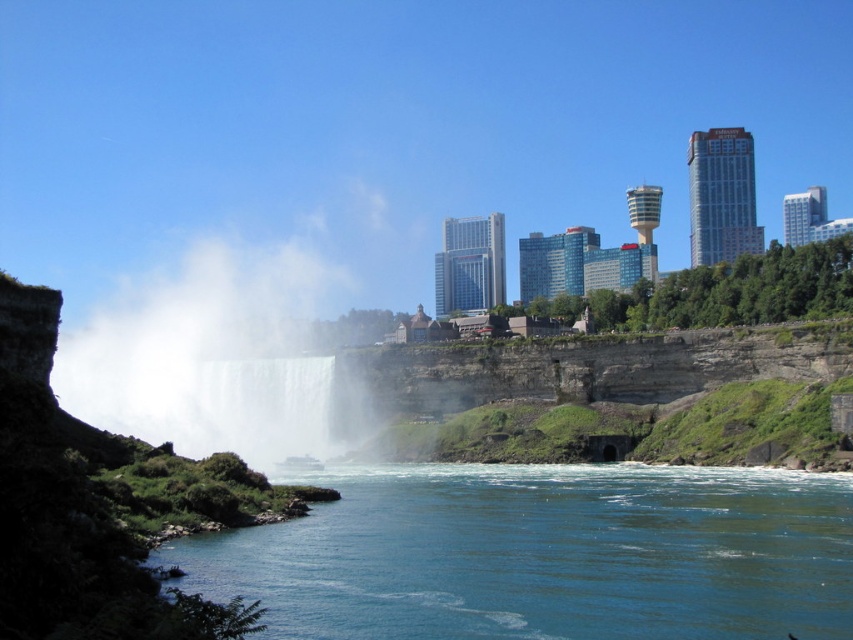
Question: Is clear blue water at lower center closer to camera compared to white misty waterfall at center?

Choices:
 (A) yes
 (B) no

Answer: (A)

Question: Which object is closer to the camera taking this photo?

Choices:
 (A) white misty waterfall at center
 (B) clear blue water at lower center

Answer: (B)

Question: Observing the image, what is the correct spatial positioning of clear blue water at lower center in reference to white misty waterfall at center?

Choices:
 (A) above
 (B) below

Answer: (B)

Question: Can you confirm if clear blue water at lower center is positioned to the left of white misty waterfall at center?

Choices:
 (A) yes
 (B) no

Answer: (B)

Question: Which point is closer to the camera?

Choices:
 (A) clear blue water at lower center
 (B) white misty waterfall at center

Answer: (A)